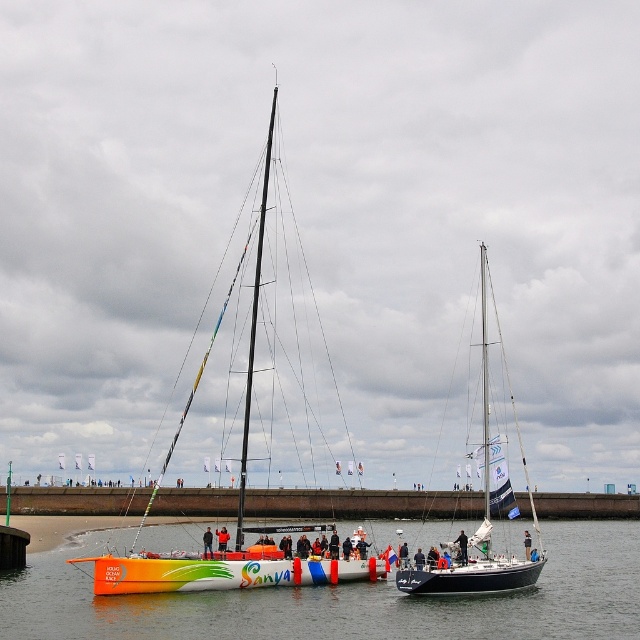
You are a photographer positioned at the edge of the dock, wanting to capture both the black matte sailboat at center and the orange fabric sailboat at center in a single frame. Which boat should you position closer to the left side of your camera viewfinder to include both in the shot?

You should position the orange fabric sailboat at center closer to the left side of your camera viewfinder because the black matte sailboat at center is to the right of the orange fabric sailboat at center, so placing the orange one on the left allows both to fit in the frame.

You are a photographer standing at the edge of the dock. You want to capture both the smooth water at center and the black leather jacket at center in a single shot. However, your camera can only focus on one object at a time. Which object should you focus on to ensure the other remains in the background?

You should focus on the smooth water at center because it is positioned under the black leather jacket at center, meaning the jacket is closer to you and the water is further back. By focusing on the water, the jacket will naturally appear in the background.